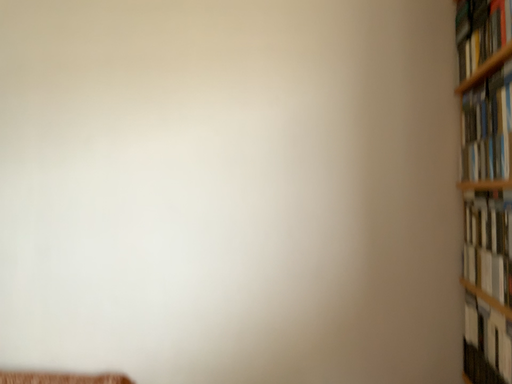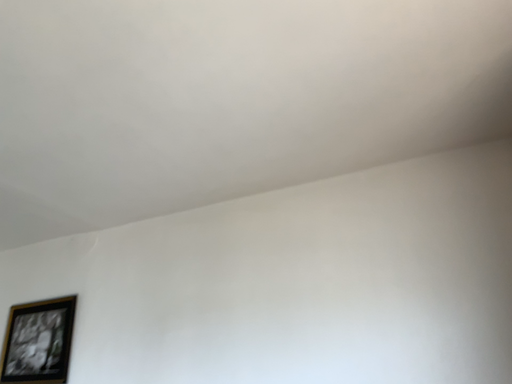
Question: How did the camera likely rotate when shooting the video?

Choices:
 (A) rotated upward
 (B) rotated downward

Answer: (A)